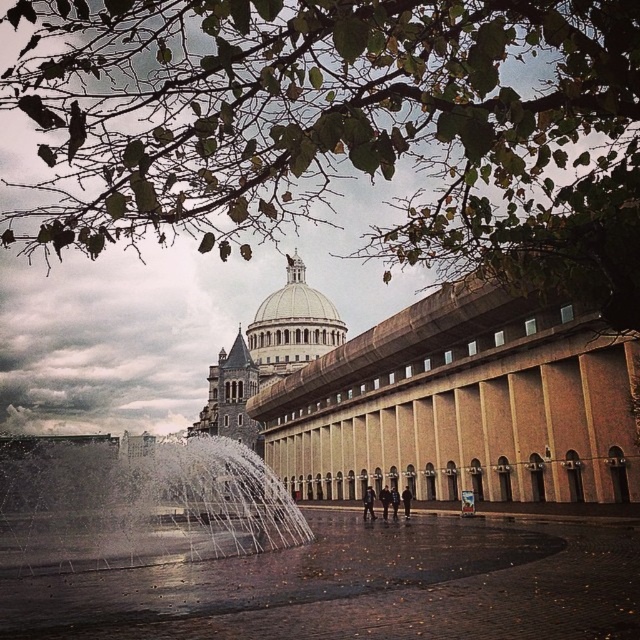
Can you confirm if white water at center is wider than dark blue jeans at center?

Yes.

Is white water at center to the right of dark blue jeans at center from the viewer's perspective?

In fact, white water at center is to the left of dark blue jeans at center.

Between point (144, 541) and point (387, 492), which one is positioned behind?

Positioned behind is point (387, 492).

Locate an element on the screen. This screenshot has height=640, width=640. white water at center is located at coordinates (138, 506).

Identify the location of white stone dome at center. The width and height of the screenshot is (640, 640). (292, 324).

Is white stone dome at center smaller than dark brown leather jacket at center?

No.

Is point (266, 326) in front of point (397, 508)?

No, it is not.

Where is `white stone dome at center`? white stone dome at center is located at coordinates (292, 324).

Between white stone dome at center and dark blue leather jacket at center, which one appears on the right side from the viewer's perspective?

From the viewer's perspective, dark blue leather jacket at center appears more on the right side.

Which is below, white stone dome at center or dark blue leather jacket at center?

dark blue leather jacket at center

Is point (326, 300) closer to viewer compared to point (371, 516)?

No, it is behind (371, 516).

Identify the location of white stone dome at center. This screenshot has width=640, height=640. pyautogui.click(x=292, y=324).